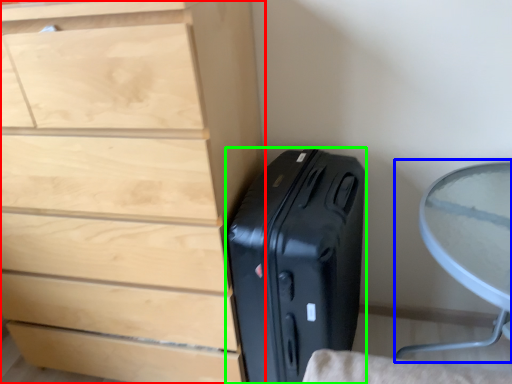
Question: Estimate the real-world distances between objects in this image. Which object is closer to chest of drawers (highlighted by a red box), round table (highlighted by a blue box) or suitcase (highlighted by a green box)?

Choices:
 (A) round table
 (B) suitcase

Answer: (B)